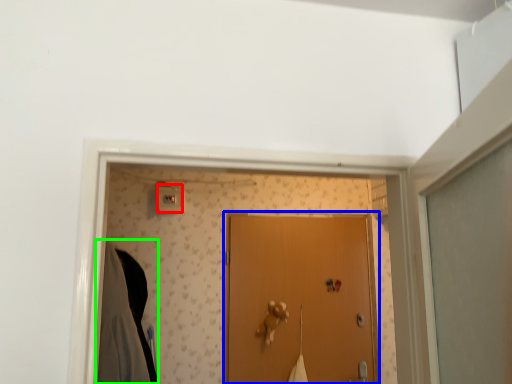
Question: Considering the real-world distances, which object is farthest from light switch (highlighted by a red box)? door (highlighted by a blue box) or robe (highlighted by a green box)?

Choices:
 (A) door
 (B) robe

Answer: (A)